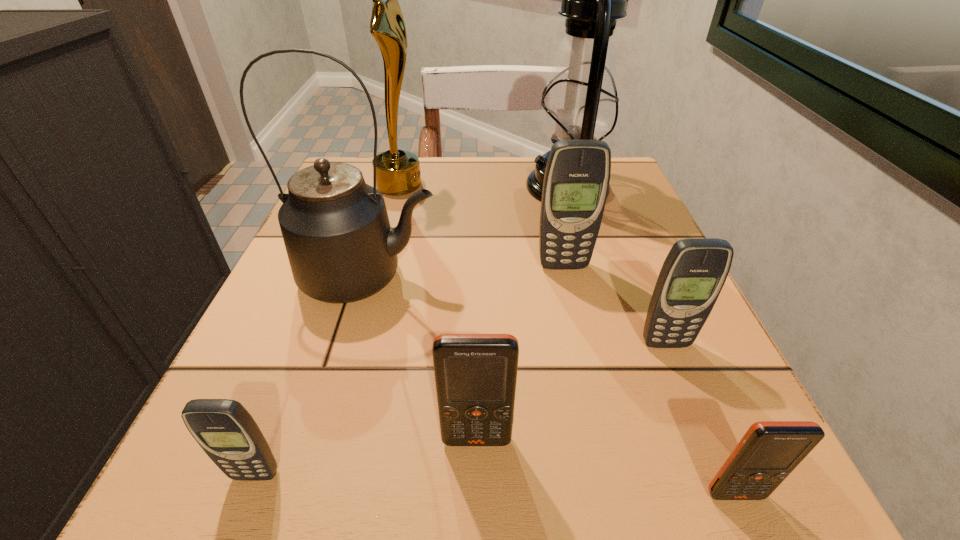
Identify the location of award that is at the left edge. This screenshot has height=540, width=960. (398, 172).

Where is `kettle that is at the left edge`? The height and width of the screenshot is (540, 960). kettle that is at the left edge is located at coordinates (341, 248).

Identify the location of cellular telephone that is at the left edge. This screenshot has width=960, height=540. (224, 429).

At what (x,y) coordinates should I click in order to perform the action: click on oil lamp positioned at the right edge. Please return your answer as a coordinate pair (x, y). This screenshot has height=540, width=960. Looking at the image, I should click on (580, 102).

Identify the location of object that is at the far left corner. (398, 172).

Where is `object at the near left corner`? The width and height of the screenshot is (960, 540). object at the near left corner is located at coordinates (224, 429).

Identify the location of object situated at the far right corner. Image resolution: width=960 pixels, height=540 pixels. pos(580,102).

Where is `object that is at the near right corner`? object that is at the near right corner is located at coordinates (769, 451).

Identify the location of vacant space at the far edge. (464, 191).

Locate an element on the screen. This screenshot has width=960, height=540. vacant space at the near edge is located at coordinates (374, 493).